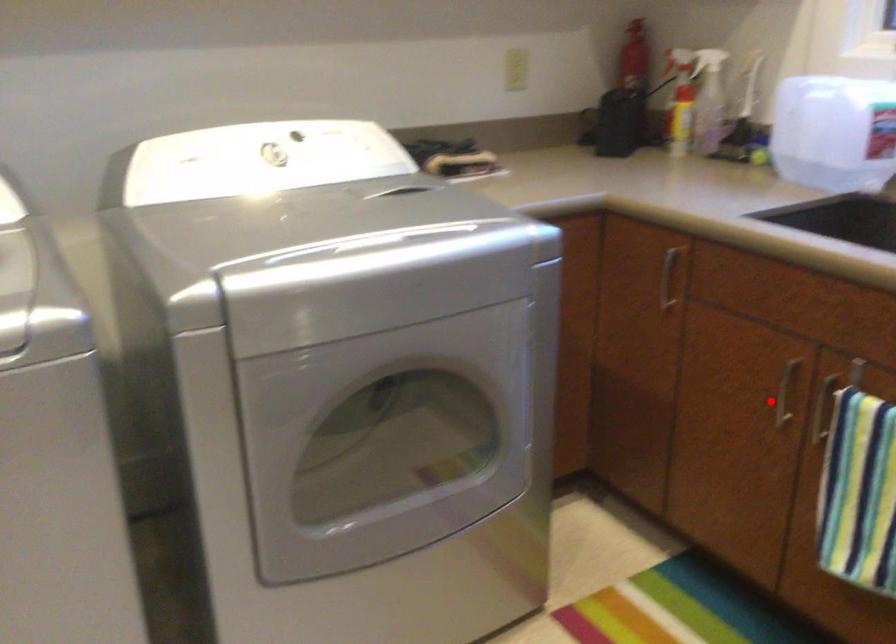
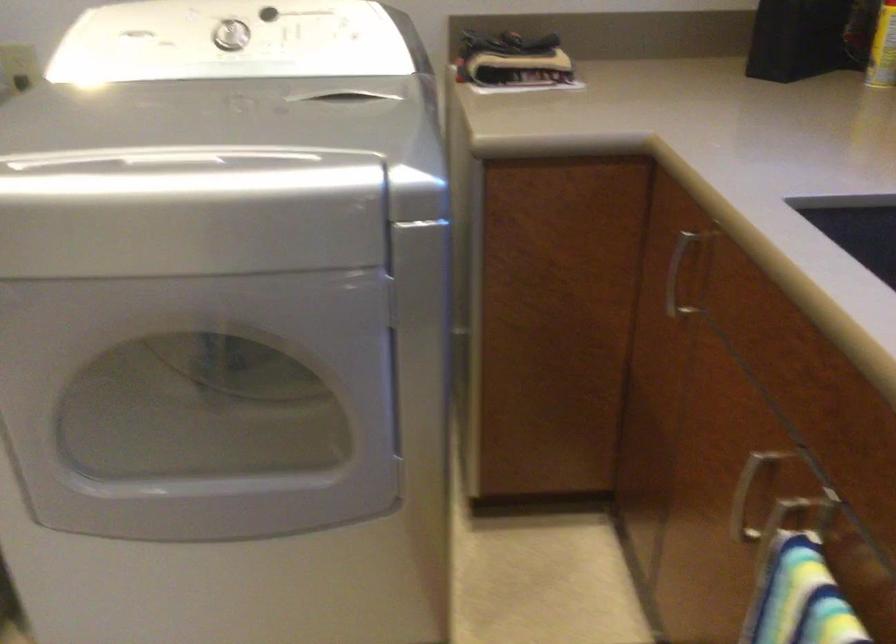
Question: I am providing you with two images of the same scene from different viewpoints. Given a red point in image1, look at the same physical point in image2. Is it:

Choices:
 (A) Closer to the viewpoint
 (B) Farther from the viewpoint

Answer: (A)